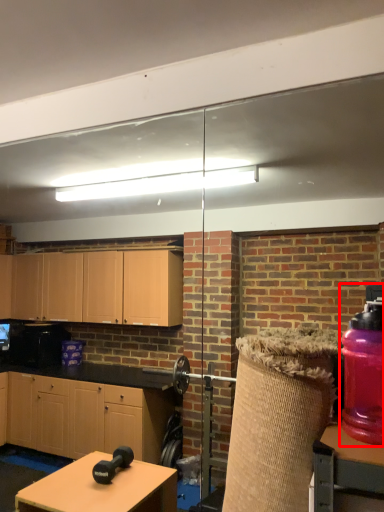
Question: From the image's perspective, considering the relative positions of bottle (annotated by the red box) and table in the image provided, where is bottle (annotated by the red box) located with respect to the staircase?

Choices:
 (A) above
 (B) below

Answer: (A)